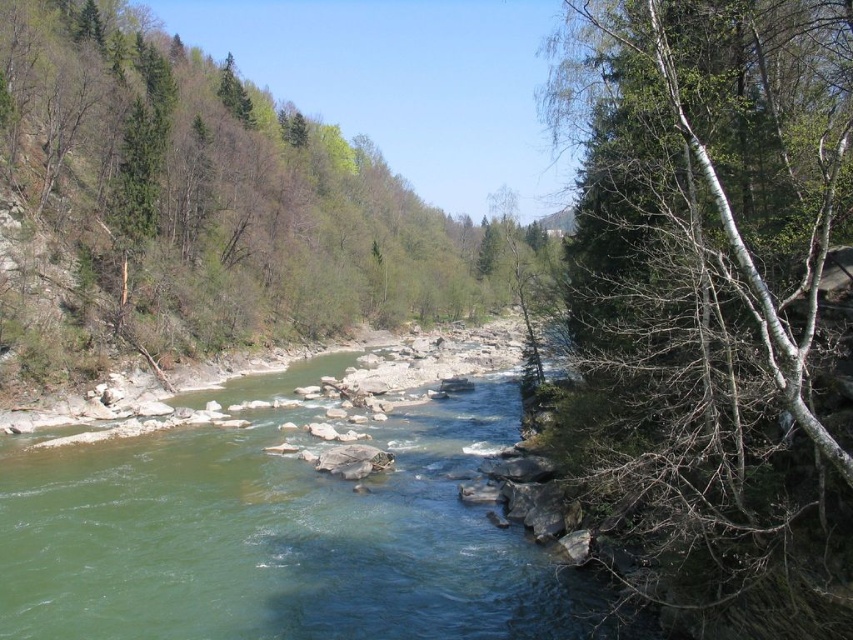
You are an environmental scientist assessing the riverbank vegetation. You notice the white bark tree at right and the green leafy tree at center. Which tree has a narrower trunk?

The white bark tree at right has a narrower trunk than the green leafy tree at center.

You are standing on the bank of the white bark tree at right and want to cross to the opposite side. Can you step onto the green smooth river at center without getting wet?

The white bark tree at right is located above the green smooth river at center, so stepping onto it would not get you wet.